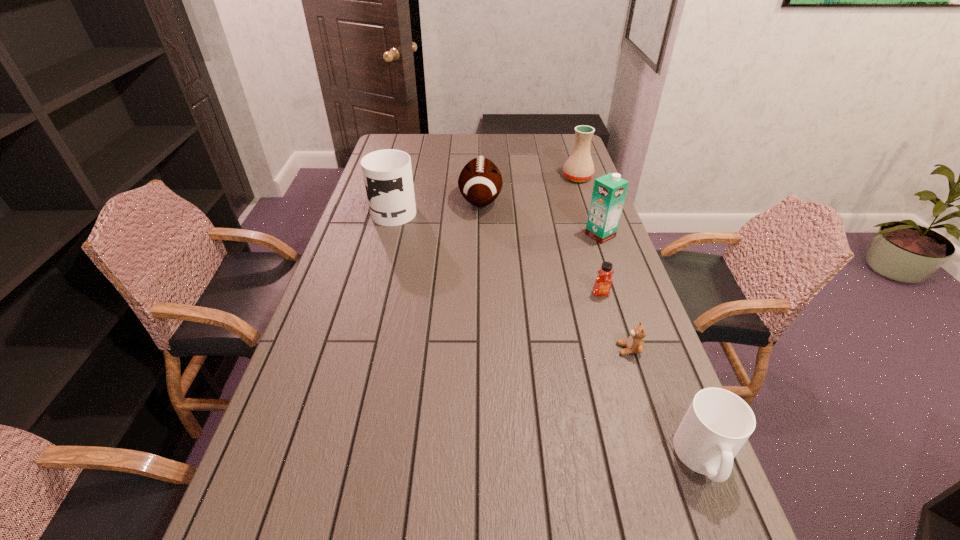
This screenshot has height=540, width=960. Identify the location of vacant region between the shortest object and the fifth tallest object. (666, 404).

You are a GUI agent. You are given a task and a screenshot of the screen. Output one action in this format:
    pyautogui.click(x=<x>, y=<y>)
    Task: Click on the free space that is in between the shortest object and the fifth farthest object
    
    Given the screenshot: What is the action you would take?
    pyautogui.click(x=615, y=321)

The height and width of the screenshot is (540, 960). What are the coordinates of `empty location between the football (American) and the carton` in the screenshot? It's located at (540, 218).

At what (x,y) coordinates should I click in order to perform the action: click on object that is the fourth closest one to the teddy bear. Please return your answer as a coordinate pair (x, y). Looking at the image, I should click on (480, 182).

Locate an element on the screen. The image size is (960, 540). object that stands as the sixth closest to the carton is located at coordinates (718, 422).

The height and width of the screenshot is (540, 960). Find the location of `free location that satisfies the following two spatial constraints: 1. on the handle side of the pottery; 2. on the right side of the farther mug`. free location that satisfies the following two spatial constraints: 1. on the handle side of the pottery; 2. on the right side of the farther mug is located at coordinates (403, 178).